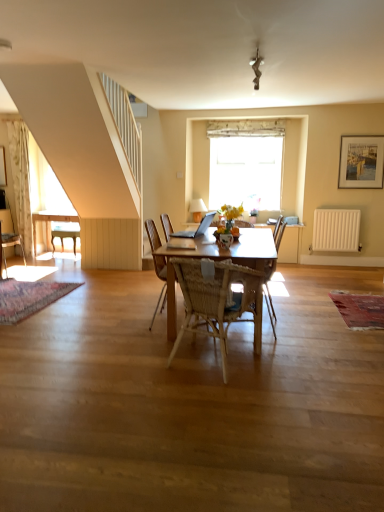
Question: In the image, is translucent glass vase at center positioned in front of or behind wooden desk at left?

Choices:
 (A) behind
 (B) front

Answer: (B)

Question: Does point (220, 238) appear closer or farther from the camera than point (51, 215)?

Choices:
 (A) farther
 (B) closer

Answer: (B)

Question: Which is nearer to the woven wood armchair at center?

Choices:
 (A) wooden chair at left, the first chair positioned from the left
 (B) woven wood chair at center, which ranks as the first chair in front-to-back order
 (C) silver metallic laptop at center
 (D) wooden framed painting at upper right
 (E) white matte radiator at right

Answer: (E)

Question: Which object is the farthest from the white fabric curtain at upper center?

Choices:
 (A) silver metallic laptop at center
 (B) translucent glass vase at center
 (C) wooden framed painting at upper right
 (D) wooden chair at left, which is the 2th chair from right to left
 (E) woven wood chair at center, which ranks as the first chair in front-to-back order

Answer: (E)